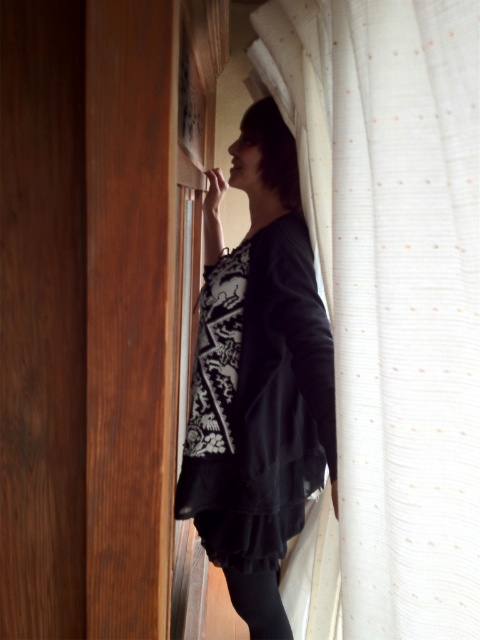
Question: Considering the relative positions of white sheer curtain at right and black matte dress at center in the image provided, where is white sheer curtain at right located with respect to black matte dress at center?

Choices:
 (A) above
 (B) below

Answer: (A)

Question: Does white sheer curtain at right appear under black matte dress at center?

Choices:
 (A) no
 (B) yes

Answer: (A)

Question: Can you confirm if white sheer curtain at right is positioned to the left of black matte dress at center?

Choices:
 (A) no
 (B) yes

Answer: (A)

Question: Which object appears farthest from the camera in this image?

Choices:
 (A) black matte dress at center
 (B) white sheer curtain at right

Answer: (A)